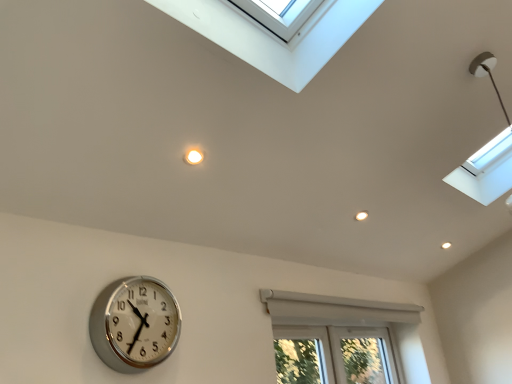
Question: Would you say white plastic window at lower center is to the left or to the right of silver metallic clock at lower left in the picture?

Choices:
 (A) right
 (B) left

Answer: (A)

Question: From a real-world perspective, is white plastic window at lower center physically located above or below silver metallic clock at lower left?

Choices:
 (A) above
 (B) below

Answer: (B)

Question: Considering the positions of white plastic window at lower center and silver metallic clock at lower left in the image, is white plastic window at lower center bigger or smaller than silver metallic clock at lower left?

Choices:
 (A) small
 (B) big

Answer: (B)

Question: Choose the correct answer: Is silver metallic clock at lower left inside white plastic window at lower center or outside it?

Choices:
 (A) inside
 (B) outside

Answer: (B)

Question: Considering the positions of point (138, 362) and point (347, 357), is point (138, 362) closer or farther from the camera than point (347, 357)?

Choices:
 (A) closer
 (B) farther

Answer: (A)

Question: Considering their positions, is silver metallic clock at lower left located in front of or behind white plastic window at lower center?

Choices:
 (A) front
 (B) behind

Answer: (A)

Question: Considering the positions of silver metallic clock at lower left and white plastic window at lower center in the image, is silver metallic clock at lower left taller or shorter than white plastic window at lower center?

Choices:
 (A) short
 (B) tall

Answer: (A)